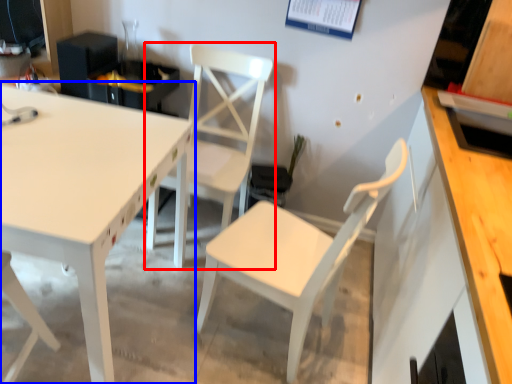
Question: Which object appears closest to the camera in this image, chair (highlighted by a red box) or table (highlighted by a blue box)?

Choices:
 (A) chair
 (B) table

Answer: (B)